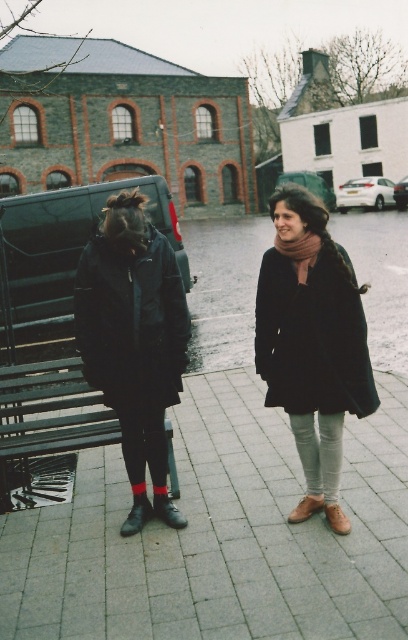
Is black rubber boot at lower left positioned before brown leather boot at lower center?

No, it is behind brown leather boot at lower center.

Can you confirm if black rubber boot at lower left is positioned below brown leather boot at lower center?

Correct, black rubber boot at lower left is located below brown leather boot at lower center.

Identify the location of black rubber boot at lower left. This screenshot has width=408, height=640. (166, 509).

Is gray concrete pavement at lower center further to the viewer compared to black leather boot at lower left?

No, it is in front of black leather boot at lower left.

Can you confirm if gray concrete pavement at lower center is positioned below black leather boot at lower left?

Incorrect, gray concrete pavement at lower center is not positioned below black leather boot at lower left.

Who is more forward, (82, 577) or (141, 518)?

Point (82, 577)

In order to click on gray concrete pavement at lower center in this screenshot , I will do `click(221, 534)`.

Between black matte coat at left and brown leather boot at lower center, which one appears on the right side from the viewer's perspective?

brown leather boot at lower center

Which is in front, point (124, 344) or point (301, 513)?

Point (124, 344) is more forward.

The image size is (408, 640). Identify the location of black matte coat at left. (133, 330).